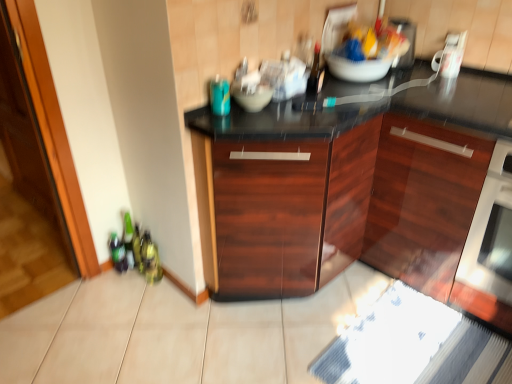
Find the location of a particular element. This screenshot has height=384, width=512. free space on the front side of matte gray bowl at center is located at coordinates (273, 117).